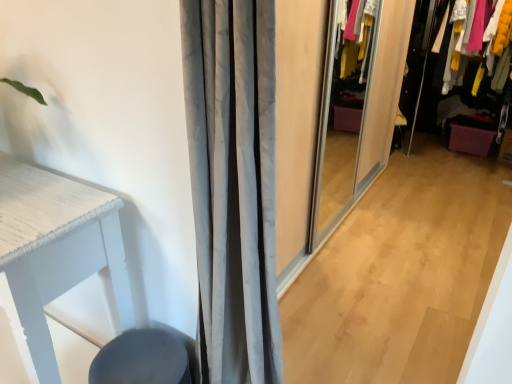
What do you see at coordinates (461, 95) in the screenshot?
I see `velvet purple drawer at right` at bounding box center [461, 95].

At what (x,y) coordinates should I click in order to perform the action: click on velvet purple drawer at right. Please return your answer as a coordinate pair (x, y). The width and height of the screenshot is (512, 384). Looking at the image, I should click on (461, 95).

Based on the photo, measure the distance between velvet purple drawer at right and camera.

A distance of 8.99 feet exists between velvet purple drawer at right and camera.

At what (x,y) coordinates should I click in order to perform the action: click on matte black swivel chair at lower left. Please return your answer as a coordinate pair (x, y). This screenshot has height=384, width=512. Looking at the image, I should click on (144, 359).

What do you see at coordinates (144, 359) in the screenshot? I see `matte black swivel chair at lower left` at bounding box center [144, 359].

The image size is (512, 384). Find the location of `velvet purple drawer at right`. velvet purple drawer at right is located at coordinates (461, 95).

Which is more to the right, matte black swivel chair at lower left or velvet purple drawer at right?

velvet purple drawer at right.

Considering the relative positions of matte black swivel chair at lower left and velvet purple drawer at right in the image provided, is matte black swivel chair at lower left behind velvet purple drawer at right?

No, matte black swivel chair at lower left is closer to the camera.

Is point (180, 366) closer or farther from the camera than point (481, 146)?

Point (180, 366).

From the image's perspective, between matte black swivel chair at lower left and velvet purple drawer at right, which one is located above?

velvet purple drawer at right.

From a real-world perspective, which object rests below the other?

matte black swivel chair at lower left, from a real-world perspective.

Can you confirm if matte black swivel chair at lower left is thinner than velvet purple drawer at right?

Yes.

Considering the relative sizes of matte black swivel chair at lower left and velvet purple drawer at right in the image provided, is matte black swivel chair at lower left shorter than velvet purple drawer at right?

Correct, matte black swivel chair at lower left is not as tall as velvet purple drawer at right.

Considering the sizes of objects matte black swivel chair at lower left and velvet purple drawer at right in the image provided, who is smaller, matte black swivel chair at lower left or velvet purple drawer at right?

matte black swivel chair at lower left.

Can we say matte black swivel chair at lower left lies outside velvet purple drawer at right?

Yes.

Is matte black swivel chair at lower left in contact with velvet purple drawer at right?

matte black swivel chair at lower left and velvet purple drawer at right are not in contact.

Is matte black swivel chair at lower left aimed at velvet purple drawer at right?

No, matte black swivel chair at lower left does not turn towards velvet purple drawer at right.

What's the angular difference between matte black swivel chair at lower left and velvet purple drawer at right's facing directions?

matte black swivel chair at lower left and velvet purple drawer at right are facing 0.368 degrees away from each other.

How distant is matte black swivel chair at lower left from velvet purple drawer at right?

matte black swivel chair at lower left is 10.27 feet away from velvet purple drawer at right.

Locate an element on the screen. swivel chair on the left of velvet purple drawer at right is located at coordinates (144, 359).

Between velvet purple drawer at right and matte black swivel chair at lower left, which one appears on the right side from the viewer's perspective?

From the viewer's perspective, velvet purple drawer at right appears more on the right side.

Does velvet purple drawer at right lie in front of matte black swivel chair at lower left?

No, it is behind matte black swivel chair at lower left.

Does point (476, 14) come closer to viewer compared to point (155, 351)?

No, it is behind (155, 351).

In the scene shown: From the image's perspective, is velvet purple drawer at right on matte black swivel chair at lower left?

Yes, from the image's perspective, velvet purple drawer at right is over matte black swivel chair at lower left.

From a real-world perspective, is velvet purple drawer at right below matte black swivel chair at lower left?

No, from a real-world perspective, velvet purple drawer at right is not below matte black swivel chair at lower left.

Considering the sizes of velvet purple drawer at right and matte black swivel chair at lower left in the image, is velvet purple drawer at right wider or thinner than matte black swivel chair at lower left?

velvet purple drawer at right is wider than matte black swivel chair at lower left.

Who is shorter, velvet purple drawer at right or matte black swivel chair at lower left?

With less height is matte black swivel chair at lower left.

Which of these two, velvet purple drawer at right or matte black swivel chair at lower left, is smaller?

With smaller size is matte black swivel chair at lower left.

Would you say velvet purple drawer at right contains matte black swivel chair at lower left?

Definitely not — matte black swivel chair at lower left is not inside velvet purple drawer at right.

Is velvet purple drawer at right touching matte black swivel chair at lower left?

No.

From the picture: Is velvet purple drawer at right positioned with its back to matte black swivel chair at lower left?

No, velvet purple drawer at right's orientation is not away from matte black swivel chair at lower left.

Measure the distance from velvet purple drawer at right to matte black swivel chair at lower left.

velvet purple drawer at right and matte black swivel chair at lower left are 3.13 meters apart from each other.

Locate an element on the screen. The height and width of the screenshot is (384, 512). closet behind the matte black swivel chair at lower left is located at coordinates coord(461,95).

Where is `swivel chair below the velvet purple drawer at right (from the image's perspective)`? This screenshot has width=512, height=384. swivel chair below the velvet purple drawer at right (from the image's perspective) is located at coordinates (144, 359).

Locate an element on the screen. Image resolution: width=512 pixels, height=384 pixels. swivel chair directly beneath the velvet purple drawer at right (from a real-world perspective) is located at coordinates (144, 359).